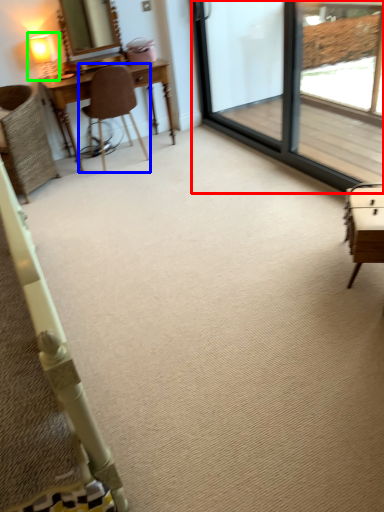
Question: Considering the real-world distances, which object is farthest from screen door (highlighted by a red box)? chair (highlighted by a blue box) or table lamp (highlighted by a green box)?

Choices:
 (A) chair
 (B) table lamp

Answer: (B)